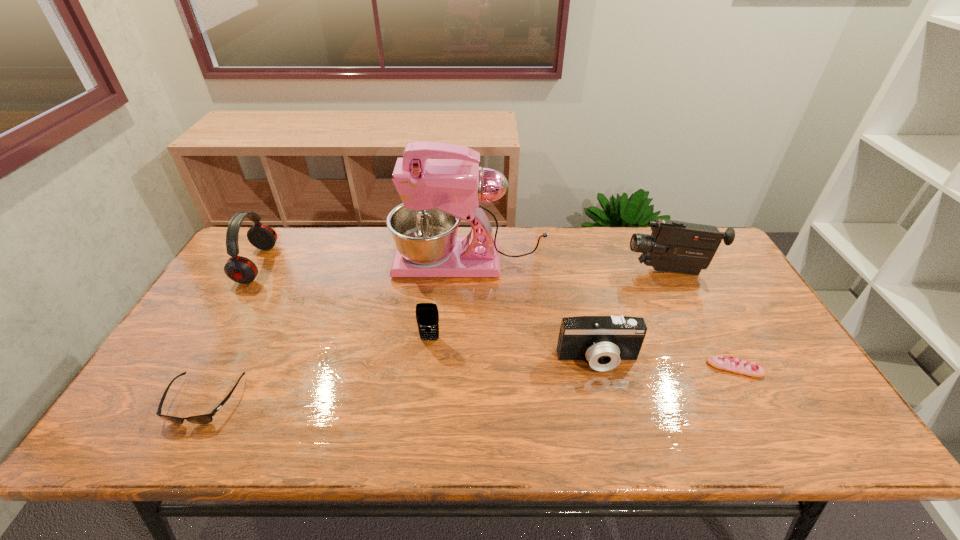
Locate an element on the screen. This screenshot has height=540, width=960. vacant position located on the face of the tallest object is located at coordinates (372, 262).

Where is `vacant space positioned 0.400m on the face of the tallest object`? The image size is (960, 540). vacant space positioned 0.400m on the face of the tallest object is located at coordinates tap(270, 262).

Where is `blank area located on the front-facing side of the taller camcorder`? blank area located on the front-facing side of the taller camcorder is located at coordinates [x=549, y=271].

The height and width of the screenshot is (540, 960). What are the coordinates of `vacant area located 0.210m on the front-facing side of the taller camcorder` in the screenshot? It's located at (559, 271).

You are a GUI agent. You are given a task and a screenshot of the screen. Output one action in this format:
    pyautogui.click(x=<x>, y=<y>)
    Task: Click on the vacant area situated 0.120m on the front-facing side of the taller camcorder
    The height and width of the screenshot is (540, 960).
    Given the screenshot: What is the action you would take?
    pyautogui.click(x=588, y=271)

Locate an element on the screen. This screenshot has width=960, height=540. free space located on the ear cups of the earphone is located at coordinates (293, 265).

Where is `free spot located 0.240m on the screen of the fourth farthest object`? The image size is (960, 540). free spot located 0.240m on the screen of the fourth farthest object is located at coordinates (420, 424).

Identify the location of free spot located 0.080m on the lens of the left camcorder. This screenshot has width=960, height=540. point(609,402).

What are the coordinates of `blank area located 0.350m on the left of the eclair` in the screenshot? It's located at (570, 368).

Identify the location of mixer positioned at the far edge. (436, 193).